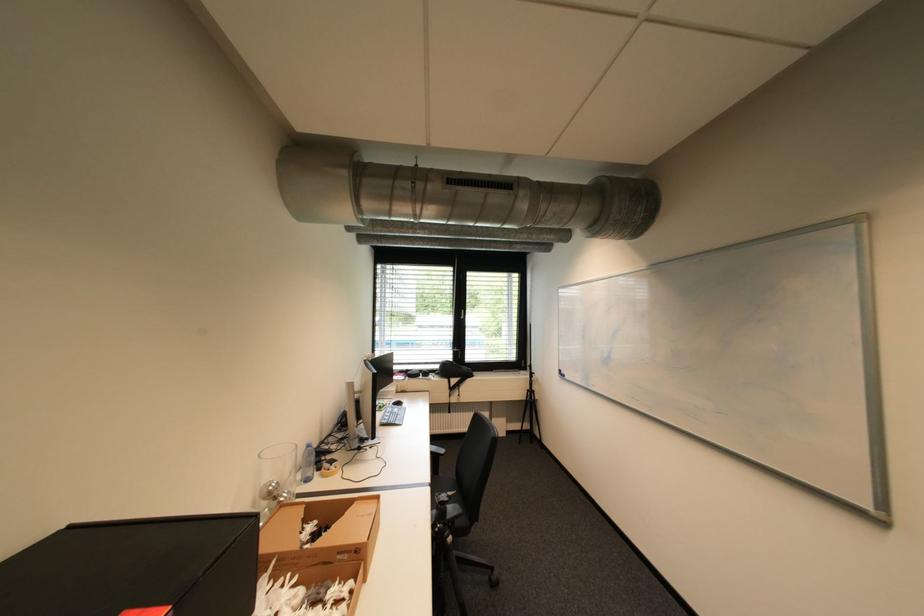
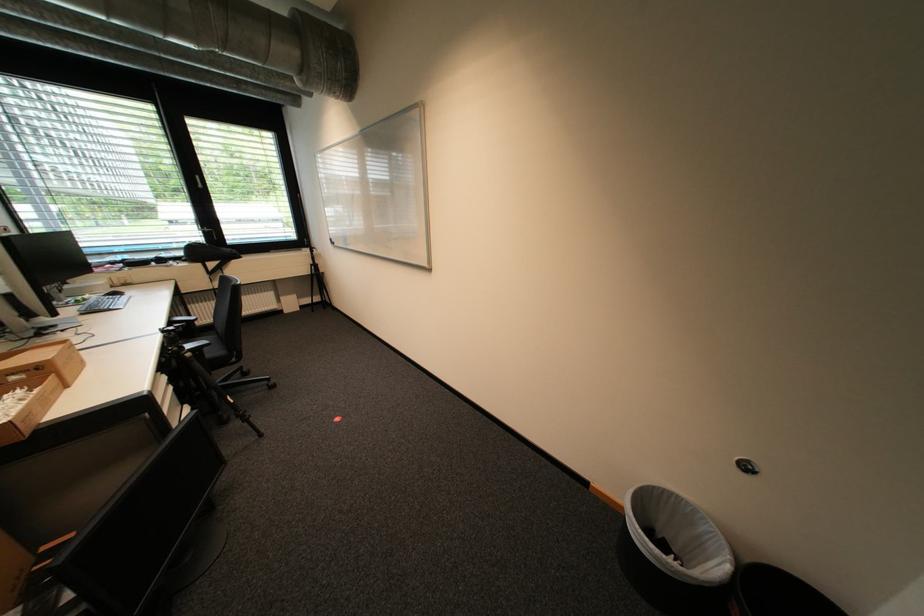
Find the pixel in the second image that matches pixel 348 554 in the first image.

(20, 375)